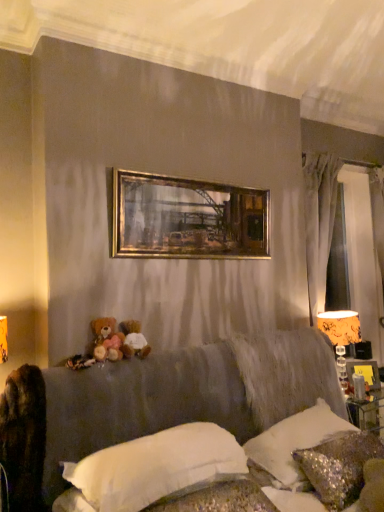
You are a GUI agent. You are given a task and a screenshot of the screen. Output one action in this format:
    pyautogui.click(x=<x>, y=<y>)
    Task: Click on the fluffy brown teddy bear at lower center, which is the first toy from left to right
    This screenshot has height=512, width=384.
    Given the screenshot: What is the action you would take?
    pyautogui.click(x=107, y=340)

This screenshot has height=512, width=384. What do you see at coordinates (341, 337) in the screenshot?
I see `orange fabric lampshade at right` at bounding box center [341, 337].

The image size is (384, 512). Find the location of `brown plush toy at lower left, the 2th toy positioned from the left`. brown plush toy at lower left, the 2th toy positioned from the left is located at coordinates (133, 339).

The image size is (384, 512). Describe the element at coordinates (293, 440) in the screenshot. I see `satin sequined pillow at lower right, which is the 2th pillow in right-to-left order` at that location.

Image resolution: width=384 pixels, height=512 pixels. What do you see at coordinates (187, 218) in the screenshot? I see `gold metallic picture frame at upper center` at bounding box center [187, 218].

This screenshot has width=384, height=512. Identify the location of fluffy brown teddy bear at lower center, which is the first toy from left to right. click(107, 340).

Measure the distance between sparkly silver pillow at lower right, the 1th pillow from the right, and orange fabric lampshade at right.

sparkly silver pillow at lower right, the 1th pillow from the right, and orange fabric lampshade at right are 38.90 inches apart from each other.

Who is more distant, sparkly silver pillow at lower right, the 1th pillow from the right, or orange fabric lampshade at right?

orange fabric lampshade at right.

Does sparkly silver pillow at lower right, the 1th pillow from the right, contain orange fabric lampshade at right?

No, sparkly silver pillow at lower right, the 1th pillow from the right, does not contain orange fabric lampshade at right.

Between sparkly silver pillow at lower right, placed as the 3th pillow when sorted from left to right, and orange fabric lampshade at right, which one has larger size?

sparkly silver pillow at lower right, placed as the 3th pillow when sorted from left to right.

From a real-world perspective, is fluffy brown teddy bear at lower center, positioned as the 2th toy in right-to-left order, physically located above or below white soft pillow at center, acting as the 3th pillow starting from the right?

In terms of real-world spatial position, fluffy brown teddy bear at lower center, positioned as the 2th toy in right-to-left order, is above white soft pillow at center, acting as the 3th pillow starting from the right.

Is fluffy brown teddy bear at lower center, which is the first toy from left to right, to the left or to the right of white soft pillow at center, which ranks as the first pillow in left-to-right order, in the image?

Clearly, fluffy brown teddy bear at lower center, which is the first toy from left to right, is on the left of white soft pillow at center, which ranks as the first pillow in left-to-right order, in the image.

Which object is thinner, gold metallic picture frame at upper center or brown plush toy at lower left, the 2th toy positioned from the left?

Thinner between the two is gold metallic picture frame at upper center.

From the image's perspective, is gold metallic picture frame at upper center located beneath brown plush toy at lower left, the 2th toy positioned from the left?

No, from the image's perspective, gold metallic picture frame at upper center is not beneath brown plush toy at lower left, the 2th toy positioned from the left.

Would you say gold metallic picture frame at upper center is a long distance from brown plush toy at lower left, placed as the first toy when sorted from right to left?

That's not correct — gold metallic picture frame at upper center is a little close to brown plush toy at lower left, placed as the first toy when sorted from right to left.

Is gold metallic picture frame at upper center shorter than fluffy brown teddy bear at lower center, positioned as the 2th toy in right-to-left order?

No.

Where is `picture frame above the fluffy brown teddy bear at lower center, which is the first toy from left to right (from a real-world perspective)`? picture frame above the fluffy brown teddy bear at lower center, which is the first toy from left to right (from a real-world perspective) is located at coordinates (187, 218).

Can you confirm if gold metallic picture frame at upper center is wider than fluffy brown teddy bear at lower center, which is the first toy from left to right?

No, gold metallic picture frame at upper center is not wider than fluffy brown teddy bear at lower center, which is the first toy from left to right.

Considering the points (321, 432) and (132, 343), which point is behind, point (321, 432) or point (132, 343)?

Point (321, 432)

Who is bigger, satin sequined pillow at lower right, arranged as the second pillow when viewed from the left, or brown plush toy at lower left, the 2th toy positioned from the left?

Bigger between the two is satin sequined pillow at lower right, arranged as the second pillow when viewed from the left.

Considering the sizes of objects satin sequined pillow at lower right, which is the 2th pillow in right-to-left order, and brown plush toy at lower left, the 2th toy positioned from the left, in the image provided, who is shorter, satin sequined pillow at lower right, which is the 2th pillow in right-to-left order, or brown plush toy at lower left, the 2th toy positioned from the left,?

brown plush toy at lower left, the 2th toy positioned from the left, is shorter.

From the image's perspective, which object appears higher, satin sequined pillow at lower right, arranged as the second pillow when viewed from the left, or brown plush toy at lower left, the 2th toy positioned from the left?

brown plush toy at lower left, the 2th toy positioned from the left.

From a real-world perspective, who is located lower, sparkly silver pillow at lower right, the 1th pillow from the right, or white soft pillow at center, which ranks as the first pillow in left-to-right order?

sparkly silver pillow at lower right, the 1th pillow from the right, from a real-world perspective.

Considering the sizes of sparkly silver pillow at lower right, placed as the 3th pillow when sorted from left to right, and white soft pillow at center, which ranks as the first pillow in left-to-right order, in the image, is sparkly silver pillow at lower right, placed as the 3th pillow when sorted from left to right, bigger or smaller than white soft pillow at center, which ranks as the first pillow in left-to-right order,?

In the image, sparkly silver pillow at lower right, placed as the 3th pillow when sorted from left to right, appears to be larger than white soft pillow at center, which ranks as the first pillow in left-to-right order.

In the scene shown: From the image's perspective, is sparkly silver pillow at lower right, placed as the 3th pillow when sorted from left to right, on white soft pillow at center, which ranks as the first pillow in left-to-right order?

Actually, sparkly silver pillow at lower right, placed as the 3th pillow when sorted from left to right, appears below white soft pillow at center, which ranks as the first pillow in left-to-right order, in the image.

What are the coordinates of `pillow in front of the sparkly silver pillow at lower right, placed as the 3th pillow when sorted from left to right` in the screenshot? It's located at (152, 468).

From the image's perspective, which object appears higher, white soft pillow at center, acting as the 3th pillow starting from the right, or gold metallic picture frame at upper center?

gold metallic picture frame at upper center.

Which object is closer to the camera, white soft pillow at center, acting as the 3th pillow starting from the right, or gold metallic picture frame at upper center?

white soft pillow at center, acting as the 3th pillow starting from the right.

What are the coordinates of `picture frame above the white soft pillow at center, acting as the 3th pillow starting from the right (from the image's perspective)` in the screenshot? It's located at pyautogui.click(x=187, y=218).

You are a GUI agent. You are given a task and a screenshot of the screen. Output one action in this format:
    pyautogui.click(x=<x>, y=<y>)
    Task: Click on the table lamp above the sparkly silver pillow at lower right, placed as the 3th pillow when sorted from left to right (from the image's perspective)
    The height and width of the screenshot is (512, 384).
    Given the screenshot: What is the action you would take?
    pyautogui.click(x=341, y=337)

Where is `toy that is the 2nd one above the white soft pillow at center, which ranks as the first pillow in left-to-right order (from a real-world perspective)`? The image size is (384, 512). toy that is the 2nd one above the white soft pillow at center, which ranks as the first pillow in left-to-right order (from a real-world perspective) is located at coordinates (107, 340).

Estimate the real-world distances between objects in this image. Which object is further from brown plush toy at lower left, placed as the first toy when sorted from right to left, sparkly silver pillow at lower right, the 1th pillow from the right, or satin sequined pillow at lower right, arranged as the second pillow when viewed from the left?

sparkly silver pillow at lower right, the 1th pillow from the right, is further to brown plush toy at lower left, placed as the first toy when sorted from right to left.

Estimate the real-world distances between objects in this image. Which object is further from fluffy brown teddy bear at lower center, which is the first toy from left to right, satin sequined pillow at lower right, arranged as the second pillow when viewed from the left, or brown plush toy at lower left, the 2th toy positioned from the left?

The object further to fluffy brown teddy bear at lower center, which is the first toy from left to right, is satin sequined pillow at lower right, arranged as the second pillow when viewed from the left.

Looking at the image, which one is located closer to satin sequined pillow at lower right, arranged as the second pillow when viewed from the left, fluffy brown teddy bear at lower center, positioned as the 2th toy in right-to-left order, or white soft pillow at center, acting as the 3th pillow starting from the right?

The object closer to satin sequined pillow at lower right, arranged as the second pillow when viewed from the left, is white soft pillow at center, acting as the 3th pillow starting from the right.

From the image, which object appears to be farther from orange fabric lampshade at right, satin sequined pillow at lower right, arranged as the second pillow when viewed from the left, or white soft pillow at center, which ranks as the first pillow in left-to-right order?

white soft pillow at center, which ranks as the first pillow in left-to-right order, is positioned further to the anchor orange fabric lampshade at right.

Looking at this image, which object lies nearer to the anchor point white soft pillow at center, acting as the 3th pillow starting from the right, satin sequined pillow at lower right, which is the 2th pillow in right-to-left order, or brown plush toy at lower left, placed as the first toy when sorted from right to left?

satin sequined pillow at lower right, which is the 2th pillow in right-to-left order, is positioned closer to the anchor white soft pillow at center, acting as the 3th pillow starting from the right.

When comparing their distances from fluffy brown teddy bear at lower center, which is the first toy from left to right, does satin sequined pillow at lower right, arranged as the second pillow when viewed from the left, or gold metallic picture frame at upper center seem closer?

gold metallic picture frame at upper center lies closer to fluffy brown teddy bear at lower center, which is the first toy from left to right, than the other object.

Considering their positions, is white soft pillow at center, acting as the 3th pillow starting from the right, positioned further to sparkly silver pillow at lower right, the 1th pillow from the right, than gold metallic picture frame at upper center?

gold metallic picture frame at upper center is positioned further to the anchor sparkly silver pillow at lower right, the 1th pillow from the right.

Based on their spatial positions, is sparkly silver pillow at lower right, the 1th pillow from the right, or gold metallic picture frame at upper center further from satin sequined pillow at lower right, arranged as the second pillow when viewed from the left?

gold metallic picture frame at upper center.

Where is `toy between fluffy brown teddy bear at lower center, positioned as the 2th toy in right-to-left order, and sparkly silver pillow at lower right, the 1th pillow from the right`? The width and height of the screenshot is (384, 512). toy between fluffy brown teddy bear at lower center, positioned as the 2th toy in right-to-left order, and sparkly silver pillow at lower right, the 1th pillow from the right is located at coordinates (133, 339).

Identify the location of pillow between sparkly silver pillow at lower right, placed as the 3th pillow when sorted from left to right, and orange fabric lampshade at right from front to back. (293, 440).

Locate an element on the screen. This screenshot has height=512, width=384. picture frame between fluffy brown teddy bear at lower center, positioned as the 2th toy in right-to-left order, and sparkly silver pillow at lower right, placed as the 3th pillow when sorted from left to right, from left to right is located at coordinates (187, 218).

At what (x,y) coordinates should I click in order to perform the action: click on picture frame between white soft pillow at center, acting as the 3th pillow starting from the right, and orange fabric lampshade at right, along the z-axis. Please return your answer as a coordinate pair (x, y). This screenshot has height=512, width=384. Looking at the image, I should click on (187, 218).